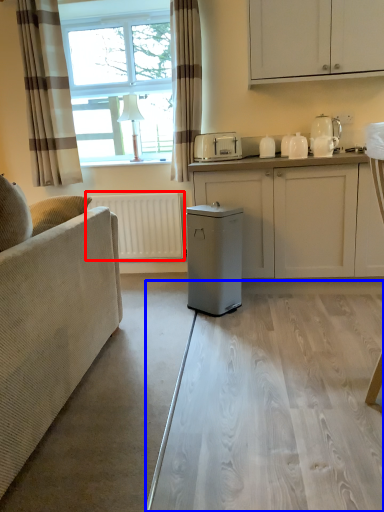
Question: Which of the following is the farthest to the observer, radiator (highlighted by a red box) or glass table (highlighted by a blue box)?

Choices:
 (A) radiator
 (B) glass table

Answer: (A)